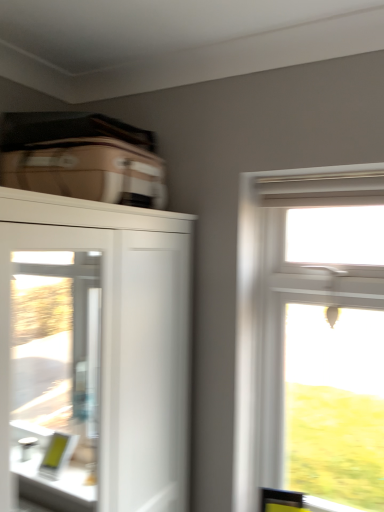
Question: Should I look upward or downward to see white glossy cupboard at upper left?

Choices:
 (A) up
 (B) down

Answer: (B)

Question: Considering the relative sizes of beige fabric suitcase at upper left and white glossy cupboard at upper left in the image provided, is beige fabric suitcase at upper left thinner than white glossy cupboard at upper left?

Choices:
 (A) yes
 (B) no

Answer: (A)

Question: Would you say beige fabric suitcase at upper left is outside white glossy cupboard at upper left?

Choices:
 (A) no
 (B) yes

Answer: (B)

Question: Considering the relative sizes of beige fabric suitcase at upper left and white glossy cupboard at upper left in the image provided, is beige fabric suitcase at upper left taller than white glossy cupboard at upper left?

Choices:
 (A) yes
 (B) no

Answer: (B)

Question: Considering the relative sizes of beige fabric suitcase at upper left and white glossy cupboard at upper left in the image provided, is beige fabric suitcase at upper left shorter than white glossy cupboard at upper left?

Choices:
 (A) yes
 (B) no

Answer: (A)

Question: Could white glossy cupboard at upper left be considered to be inside beige fabric suitcase at upper left?

Choices:
 (A) yes
 (B) no

Answer: (B)

Question: Can you confirm if beige fabric suitcase at upper left is positioned to the right of white glossy cupboard at upper left?

Choices:
 (A) no
 (B) yes

Answer: (B)

Question: Can you confirm if clear glass screen door at left is smaller than clear glass window at upper right?

Choices:
 (A) no
 (B) yes

Answer: (B)

Question: Considering the relative sizes of clear glass screen door at left and clear glass window at upper right in the image provided, is clear glass screen door at left taller than clear glass window at upper right?

Choices:
 (A) no
 (B) yes

Answer: (A)

Question: Is clear glass screen door at left looking in the opposite direction of clear glass window at upper right?

Choices:
 (A) yes
 (B) no

Answer: (B)

Question: Is clear glass screen door at left far away from clear glass window at upper right?

Choices:
 (A) yes
 (B) no

Answer: (A)

Question: Considering the relative sizes of clear glass screen door at left and clear glass window at upper right in the image provided, is clear glass screen door at left thinner than clear glass window at upper right?

Choices:
 (A) no
 (B) yes

Answer: (B)

Question: Does clear glass screen door at left have a greater width compared to clear glass window at upper right?

Choices:
 (A) yes
 (B) no

Answer: (B)

Question: Is clear glass window at upper right shorter than clear glass screen door at left?

Choices:
 (A) yes
 (B) no

Answer: (B)